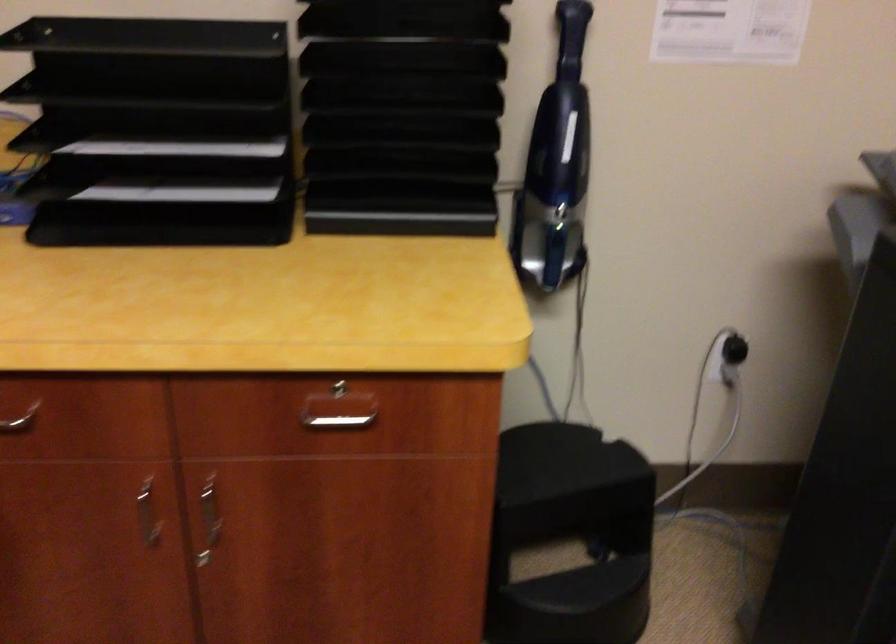
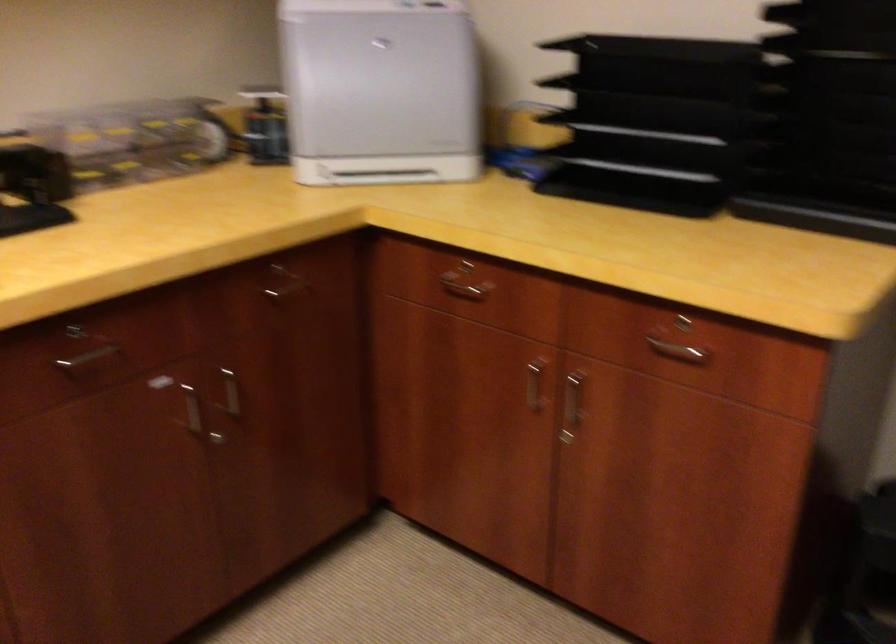
In the second image, find the point that corresponds to [343,80] in the first image.

(823, 93)